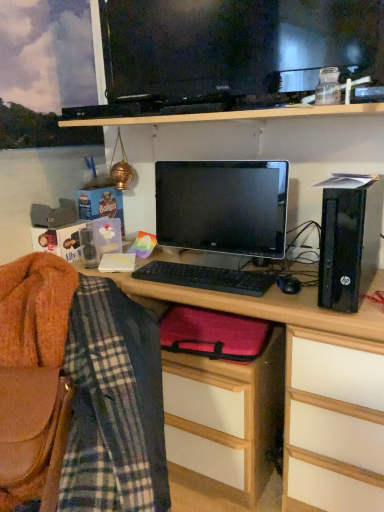
Question: Should I look upward or downward to see black matte keyboard at center?

Choices:
 (A) down
 (B) up

Answer: (A)

Question: Is black plastic computer tower at right outside of plaid fabric at left?

Choices:
 (A) yes
 (B) no

Answer: (A)

Question: Is black plastic computer tower at right further to the viewer compared to plaid fabric at left?

Choices:
 (A) no
 (B) yes

Answer: (B)

Question: Is the position of black plastic computer tower at right less distant than that of plaid fabric at left?

Choices:
 (A) yes
 (B) no

Answer: (B)

Question: Considering the relative sizes of black plastic computer tower at right and plaid fabric at left in the image provided, is black plastic computer tower at right thinner than plaid fabric at left?

Choices:
 (A) no
 (B) yes

Answer: (B)

Question: From a real-world perspective, is black plastic computer tower at right on top of plaid fabric at left?

Choices:
 (A) no
 (B) yes

Answer: (B)

Question: Is black plastic computer tower at right bigger than plaid fabric at left?

Choices:
 (A) no
 (B) yes

Answer: (A)

Question: Does black matte keyboard at center appear on the left side of black plastic computer tower at right?

Choices:
 (A) no
 (B) yes

Answer: (B)

Question: Is black matte keyboard at center shorter than black plastic computer tower at right?

Choices:
 (A) yes
 (B) no

Answer: (A)

Question: Is black matte keyboard at center next to black plastic computer tower at right and touching it?

Choices:
 (A) no
 (B) yes

Answer: (A)

Question: Is black matte keyboard at center completely or partially outside of black plastic computer tower at right?

Choices:
 (A) no
 (B) yes

Answer: (B)

Question: From a real-world perspective, is black matte keyboard at center under black plastic computer tower at right?

Choices:
 (A) yes
 (B) no

Answer: (A)

Question: From the image's perspective, is black matte keyboard at center above black plastic computer tower at right?

Choices:
 (A) yes
 (B) no

Answer: (B)

Question: Considering the relative positions of black plastic computer tower at right and black plastic mouse at center in the image provided, is black plastic computer tower at right behind black plastic mouse at center?

Choices:
 (A) yes
 (B) no

Answer: (B)